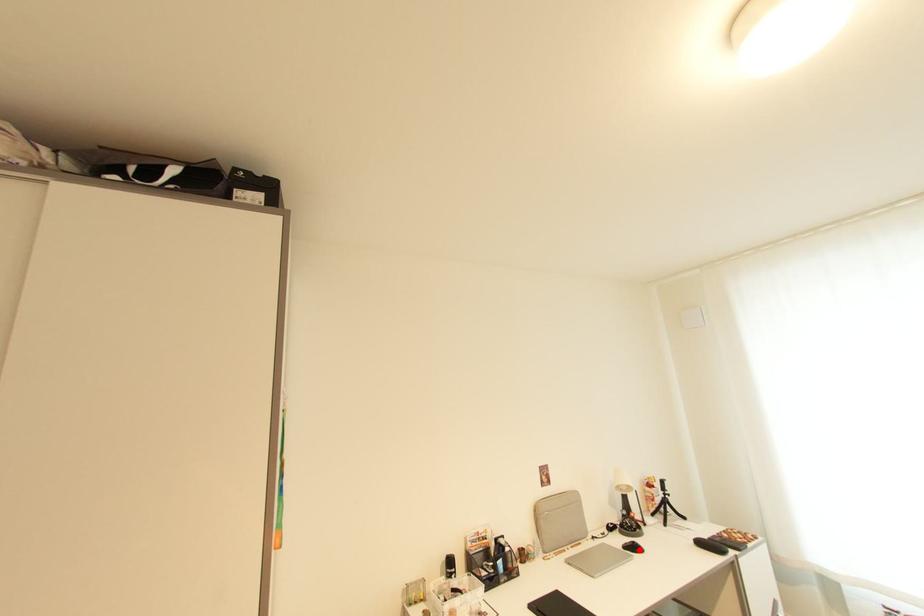
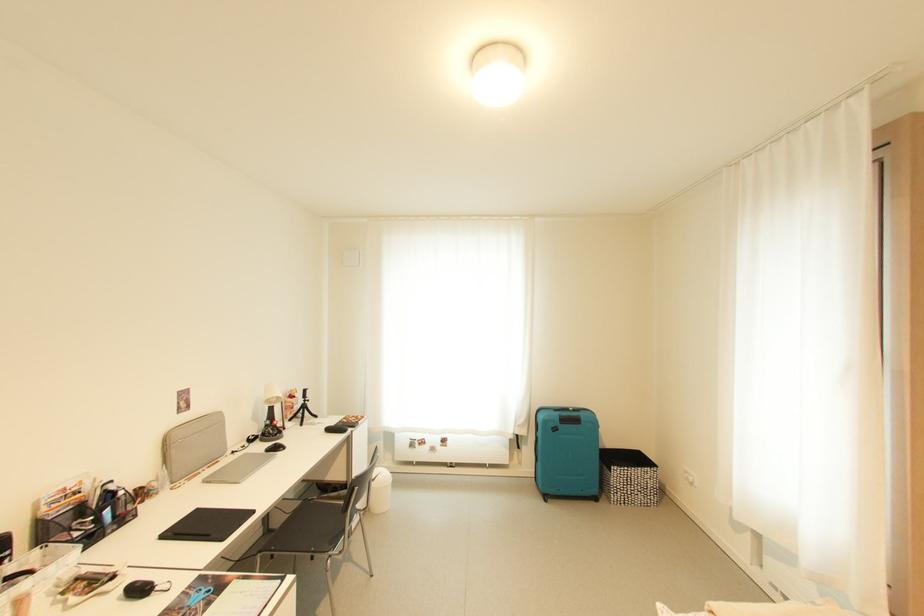
Question: I am providing you with two images of the same scene from different viewpoints. A red point is marked on the first image. At the location where the point appears in image 1, is it still visible in image 2?

Choices:
 (A) Yes
 (B) No

Answer: (A)